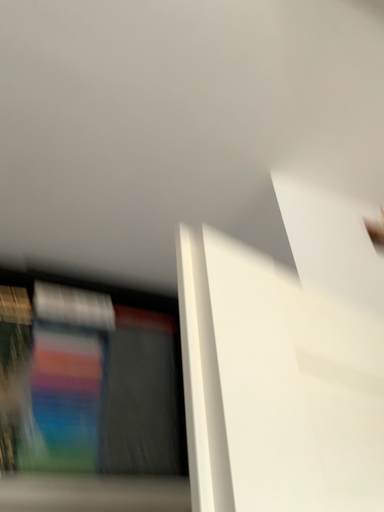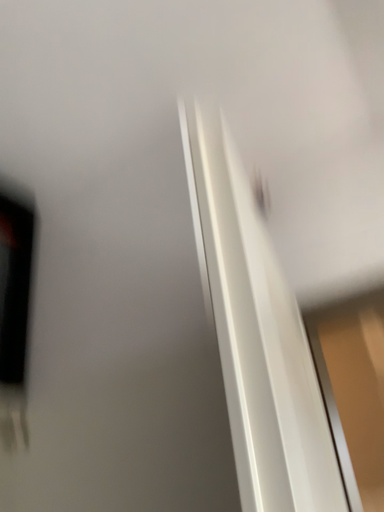
Question: How did the camera likely rotate when shooting the video?

Choices:
 (A) rotated upward
 (B) rotated downward

Answer: (B)